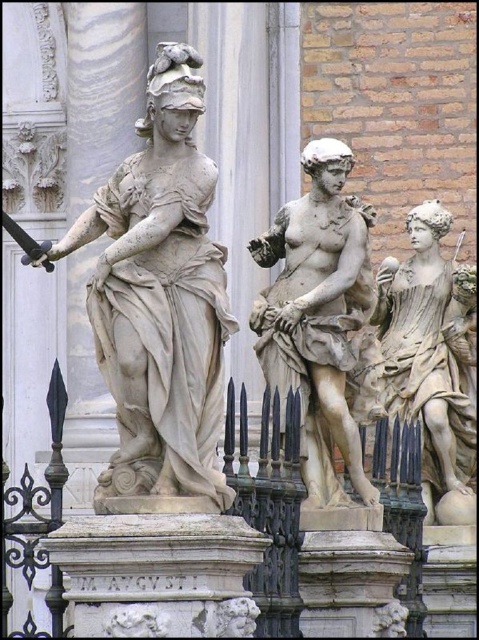
Question: Can you confirm if white marble statue at center is thinner than matte stone statue at center?

Choices:
 (A) no
 (B) yes

Answer: (A)

Question: Is the position of matte stone statue at center less distant than that of matte beige statue at right?

Choices:
 (A) no
 (B) yes

Answer: (B)

Question: Estimate the real-world distances between objects in this image. Which object is closer to the matte beige statue at right?

Choices:
 (A) black wrought iron fence at center
 (B) white marble statue at center

Answer: (A)

Question: Among these objects, which one is farthest from the camera?

Choices:
 (A) black wrought iron fence at center
 (B) white marble statue at center
 (C) matte stone statue at center

Answer: (C)

Question: Is white marble statue at center below matte stone statue at center?

Choices:
 (A) yes
 (B) no

Answer: (B)

Question: Which is nearer to the black wrought iron fence at center?

Choices:
 (A) matte stone statue at center
 (B) matte beige statue at right
 (C) white marble statue at center

Answer: (A)